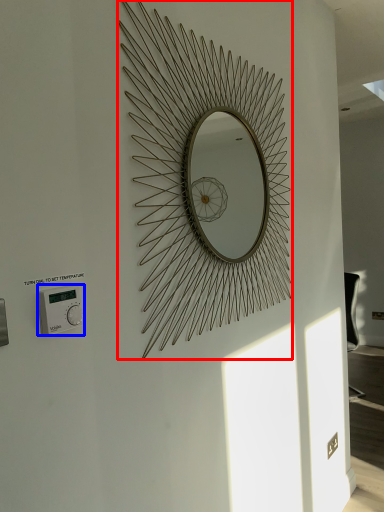
Question: Which object is closer to the camera taking this photo, oval (highlighted by a red box) or thermostat (highlighted by a blue box)?

Choices:
 (A) oval
 (B) thermostat

Answer: (B)